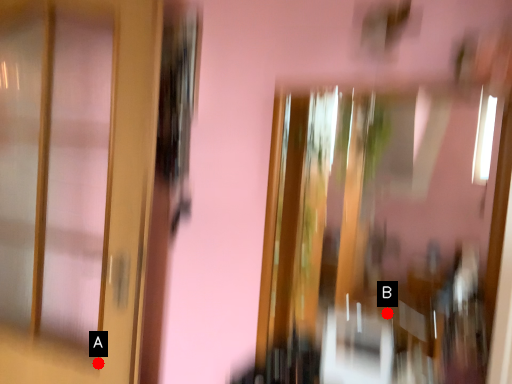
Question: Two points are circled on the image, labeled by A and B beside each circle. Among these points, which one is farthest from the camera?

Choices:
 (A) A is further
 (B) B is further

Answer: (A)